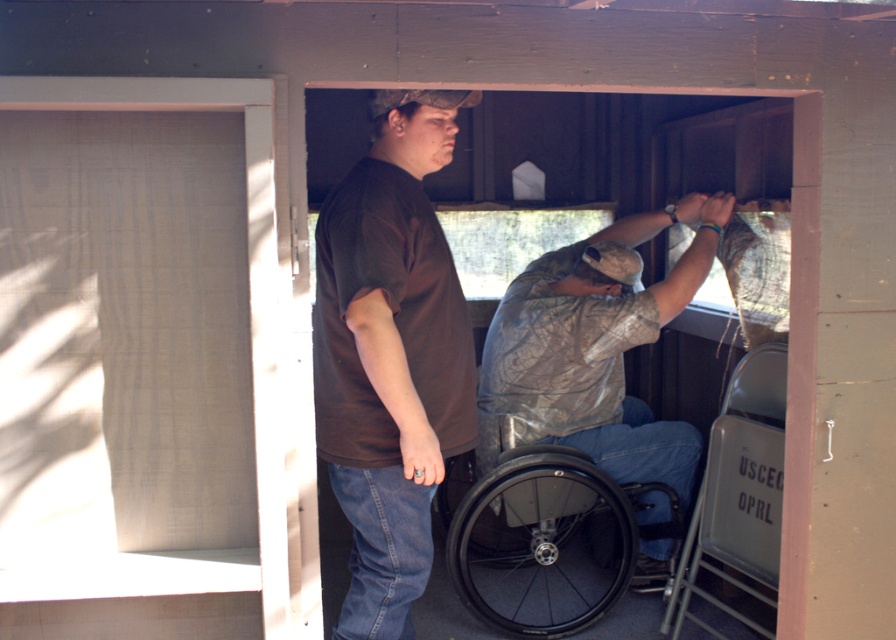
Does black rubber wheelchair at lower center have a smaller size compared to camouflage fabric shirt at center?

No, black rubber wheelchair at lower center is not smaller than camouflage fabric shirt at center.

Is black rubber wheelchair at lower center thinner than camouflage fabric shirt at center?

Incorrect, black rubber wheelchair at lower center's width is not less than camouflage fabric shirt at center's.

Is point (770, 534) closer to viewer compared to point (640, 433)?

Yes, it is in front of point (640, 433).

Identify the location of black rubber wheelchair at lower center. This screenshot has width=896, height=640. (623, 522).

Does brown matte shirt at center come behind camouflage fabric shirt at center?

No.

Measure the distance between brown matte shirt at center and camera.

brown matte shirt at center and camera are 2.33 meters apart.

Identify the location of brown matte shirt at center. The height and width of the screenshot is (640, 896). (390, 355).

This screenshot has width=896, height=640. Identify the location of brown matte shirt at center. (390, 355).

Is brown matte shirt at center shorter than black rubber wheelchair at lower center?

In fact, brown matte shirt at center may be taller than black rubber wheelchair at lower center.

Looking at this image, is brown matte shirt at center to the left of black rubber wheelchair at lower center from the viewer's perspective?

Correct, you'll find brown matte shirt at center to the left of black rubber wheelchair at lower center.

Is point (451, 260) positioned before point (623, 550)?

That is True.

This screenshot has width=896, height=640. In order to click on brown matte shirt at center in this screenshot , I will do `click(390, 355)`.